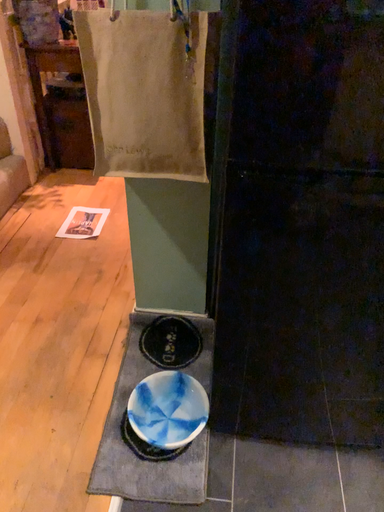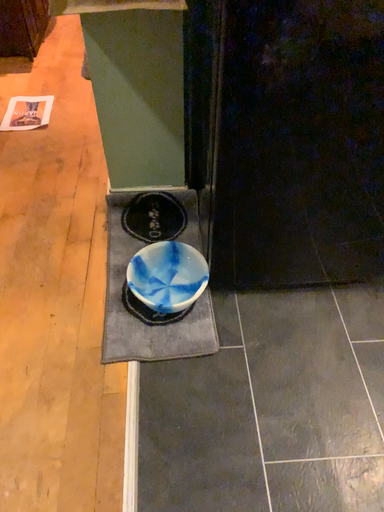
Question: How did the camera likely rotate when shooting the video?

Choices:
 (A) rotated upward
 (B) rotated downward

Answer: (B)